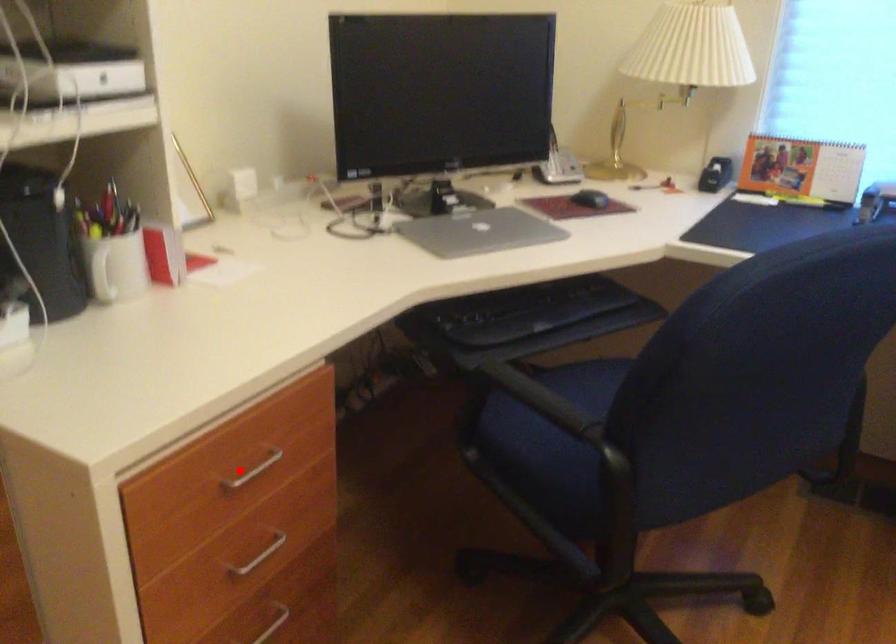
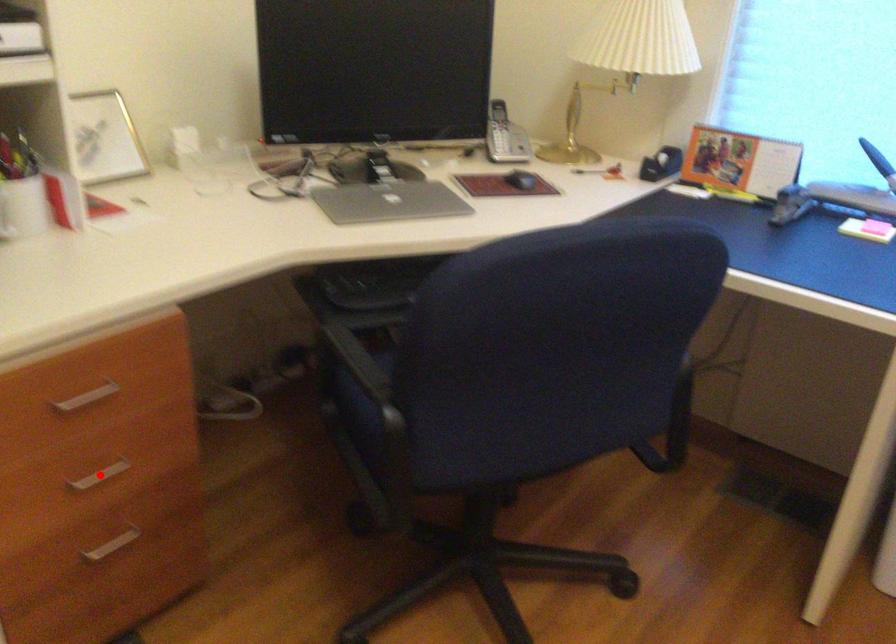
I am providing you with two images of the same scene from different viewpoints. A red point is marked on the first image and another point is marked on the second image. Is the red point in image1 aligned with the point shown in image2?

No